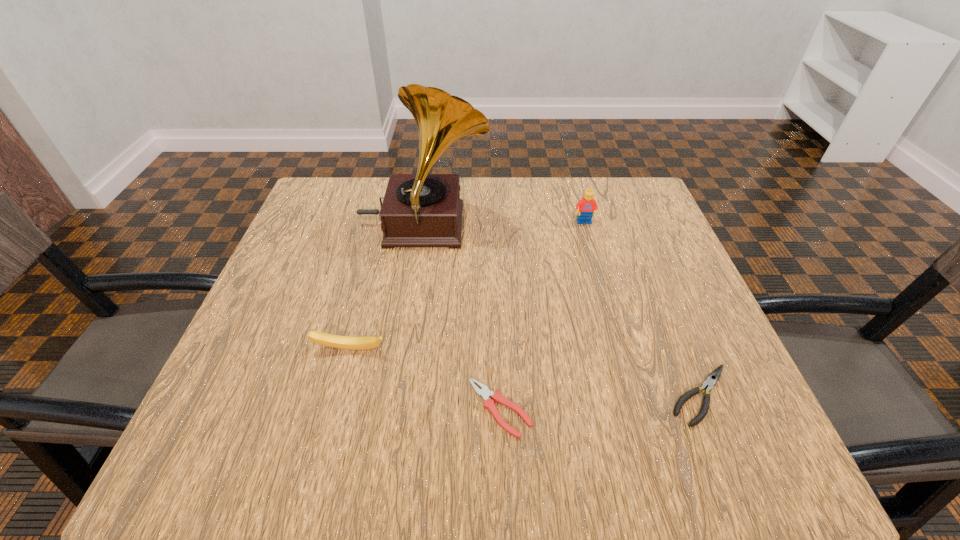
The image size is (960, 540). Find the location of `free space between the third shortest object and the phonograph record`. free space between the third shortest object and the phonograph record is located at coordinates (387, 288).

Image resolution: width=960 pixels, height=540 pixels. What are the coordinates of `free space between the left pliers and the tallest object` in the screenshot? It's located at (462, 317).

Where is `vacant space in between the phonograph record and the shortest object`? This screenshot has height=540, width=960. vacant space in between the phonograph record and the shortest object is located at coordinates coord(462,317).

At what (x,y) coordinates should I click in order to perform the action: click on vacant region between the second object from right to left and the phonograph record. Please return your answer as a coordinate pair (x, y). The width and height of the screenshot is (960, 540). Looking at the image, I should click on (504, 224).

In order to click on empty space between the shorter pliers and the phonograph record in this screenshot , I will do `click(462, 317)`.

Locate an element on the screen. This screenshot has height=540, width=960. free spot between the Lego and the right pliers is located at coordinates (642, 309).

Locate an element on the screen. This screenshot has width=960, height=540. free space between the tallest object and the shorter pliers is located at coordinates (462, 317).

At what (x,y) coordinates should I click in order to perform the action: click on empty location between the tallest object and the third farthest object. Please return your answer as a coordinate pair (x, y). The image size is (960, 540). Looking at the image, I should click on (387, 288).

Locate which object is the second closest to the rightmost object. Please provide its 2D coordinates. Your answer should be formatted as a tuple, i.e. [(x, y)], where the tuple contains the x and y coordinates of a point satisfying the conditions above.

[(585, 207)]

Choose which object is the third nearest neighbor to the left pliers. Please provide its 2D coordinates. Your answer should be formatted as a tuple, i.e. [(x, y)], where the tuple contains the x and y coordinates of a point satisfying the conditions above.

[(419, 210)]